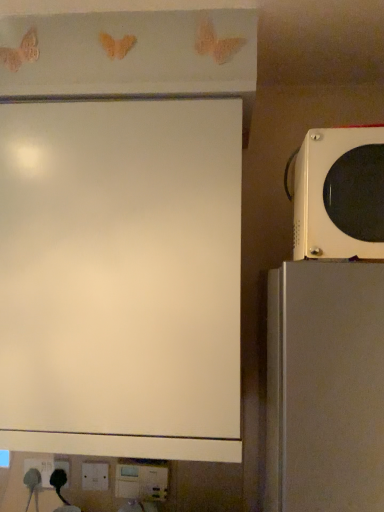
Question: Considering their positions, is white glossy microwave at right located in front of or behind white matte board at upper left?

Choices:
 (A) front
 (B) behind

Answer: (A)

Question: From a real-world perspective, is white glossy microwave at right above or below white matte board at upper left?

Choices:
 (A) below
 (B) above

Answer: (B)

Question: Which is farther from the white glossy microwave at right?

Choices:
 (A) white matte board at upper left
 (B) white plastic electric outlet at lower left

Answer: (B)

Question: Based on their relative distances, which object is farther from the white matte board at upper left?

Choices:
 (A) white glossy microwave at right
 (B) white plastic electric outlet at lower left

Answer: (B)